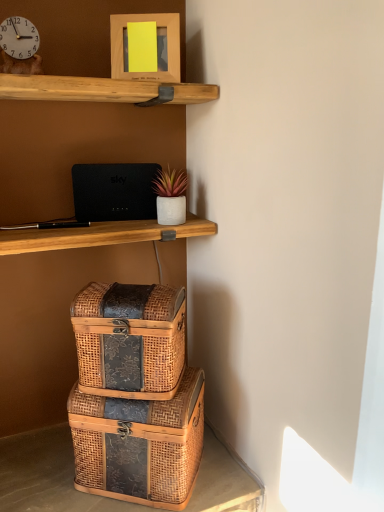
Question: From a real-world perspective, is woven wood box at center, the first box when ordered from bottom to top, above or below woven wood trunk at lower center?

Choices:
 (A) below
 (B) above

Answer: (B)

Question: Based on their positions, is woven wood box at center, which appears as the second box when viewed from the top, located to the left or right of woven wood trunk at lower center?

Choices:
 (A) left
 (B) right

Answer: (B)

Question: Estimate the real-world distances between objects in this image. Which object is farther from the woven wood box at center, which appears as the second box when viewed from the top?

Choices:
 (A) white glossy clock at upper left
 (B) woven wood box at lower center, positioned as the 1th box in top-to-bottom order
 (C) woven wood trunk at lower center
 (D) wooden picture frame at upper center
 (E) black matte router at upper center

Answer: (A)

Question: Considering the real-world distances, which object is farthest from the wooden picture frame at upper center?

Choices:
 (A) woven wood box at center, which appears as the second box when viewed from the top
 (B) black matte router at upper center
 (C) woven wood trunk at lower center
 (D) woven wood box at lower center, positioned as the 1th box in top-to-bottom order
 (E) white glossy clock at upper left

Answer: (C)